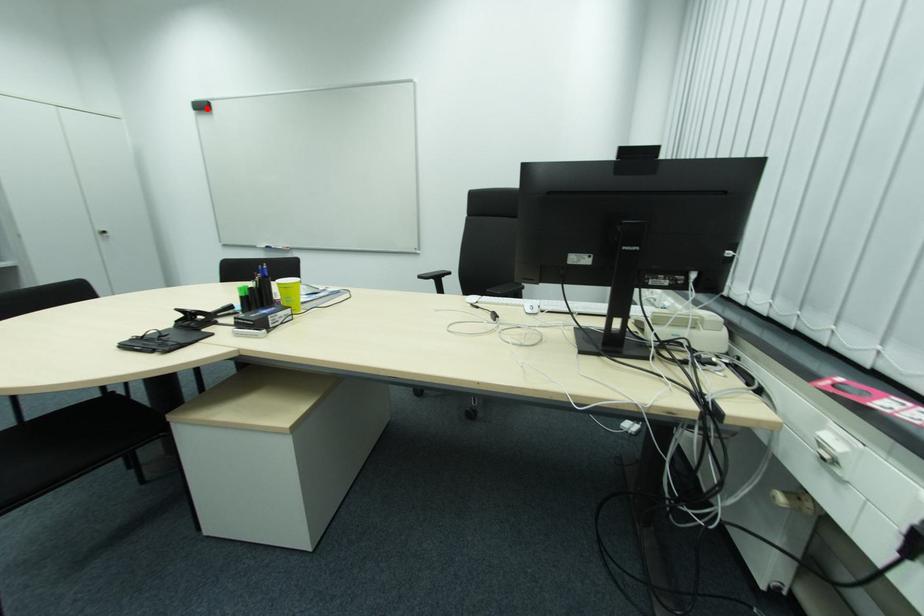
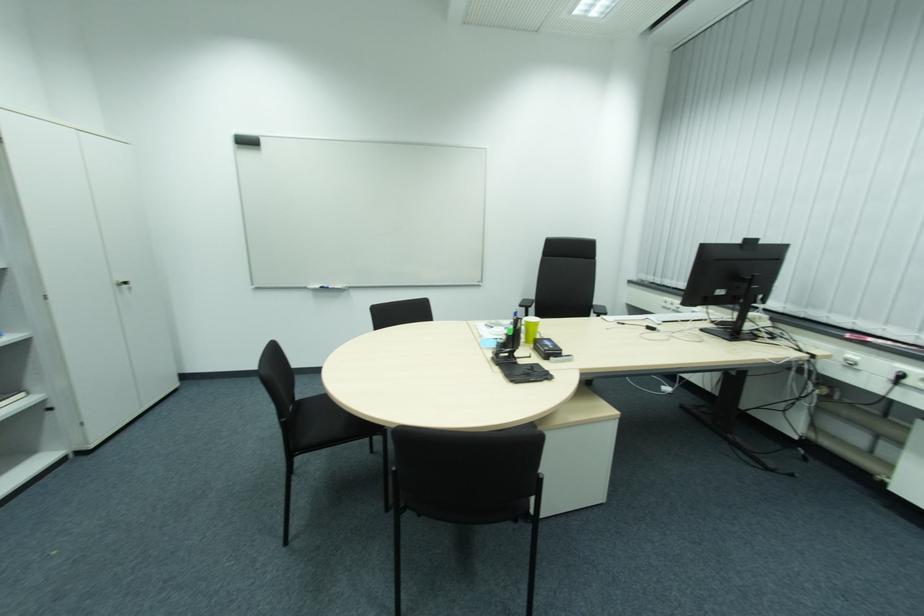
Locate, in the second image, the point that corresponds to the highlighted location in the first image.

(252, 144)